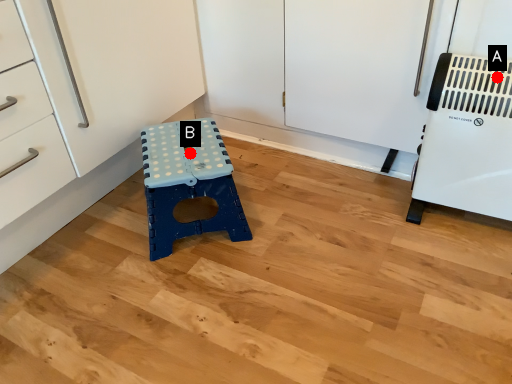
Question: Two points are circled on the image, labeled by A and B beside each circle. Which of the following is the closest to the observer?

Choices:
 (A) A is closer
 (B) B is closer

Answer: (A)